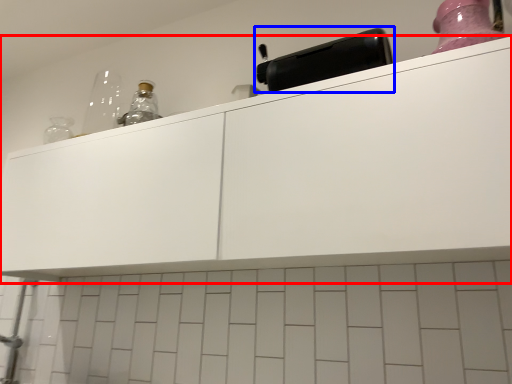
Question: Which object appears farthest to the camera in this image, cabinetry (highlighted by a red box) or appliance (highlighted by a blue box)?

Choices:
 (A) cabinetry
 (B) appliance

Answer: (B)